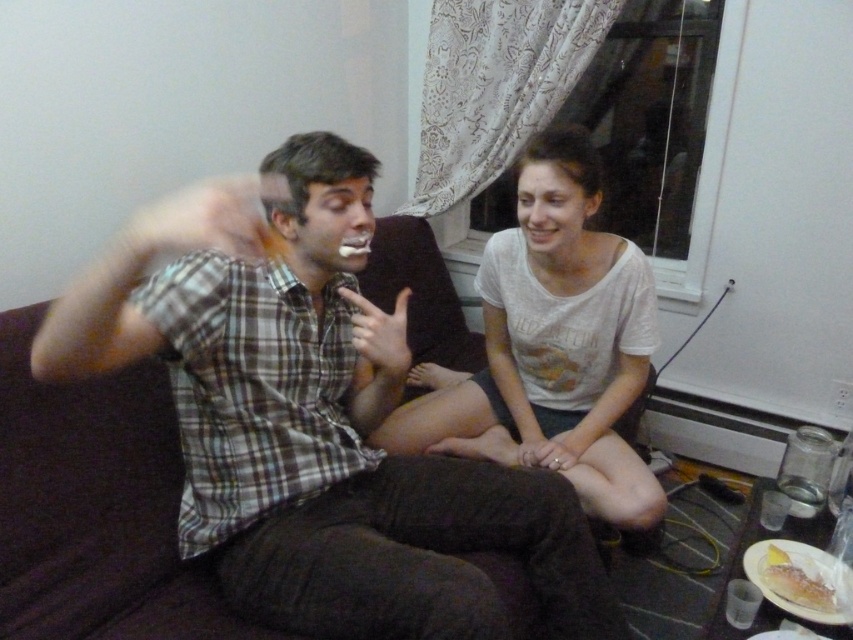
You are a photographer trying to capture a candid shot of the white cotton shirt at center and the yellow cake at lower right. Since you want to ensure both are in focus, you need to know which object is taller. Which one is taller?

The white cotton shirt at center is taller than the yellow cake at lower right according to the description.

Looking at this image, you are standing in the room and want to hand a spoon to the person wearing the plaid shirt at center. Based on their position at point 0.653, 0.368, where should you walk to reach them?

The plaid shirt at center is located at coordinates point (312, 417), so you should walk towards that position to reach them.

You are a photographer setting up a shot of the scene. You want to ensure that both the plaid shirt at center and the yellow cake at lower right are clearly visible in the frame. Based on their positions, which object should you focus on first to ensure depth of field captures both?

The plaid shirt at center is located above the yellow cake at lower right, so focusing on the plaid shirt at center first will help ensure the yellow cake at lower right remains in focus due to its position below.